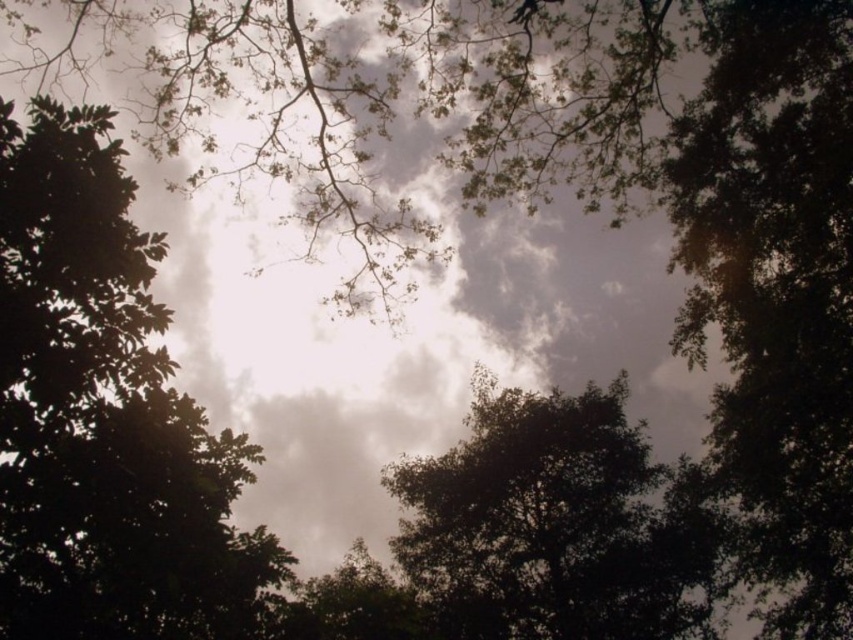
Question: Which point is farther from the camera taking this photo?

Choices:
 (A) (164, 369)
 (B) (527, 481)

Answer: (B)

Question: Among these points, which one is farthest from the camera?

Choices:
 (A) (6, 346)
 (B) (489, 540)

Answer: (B)

Question: Is green leafy tree at upper center below dark green leafy tree at center?

Choices:
 (A) yes
 (B) no

Answer: (B)

Question: Can you confirm if green leafy tree at upper center is positioned to the left of dark green leafy tree at center?

Choices:
 (A) no
 (B) yes

Answer: (B)

Question: From the image, what is the correct spatial relationship of green leafy tree at upper center in relation to dark green leafy tree at center?

Choices:
 (A) below
 (B) above

Answer: (B)